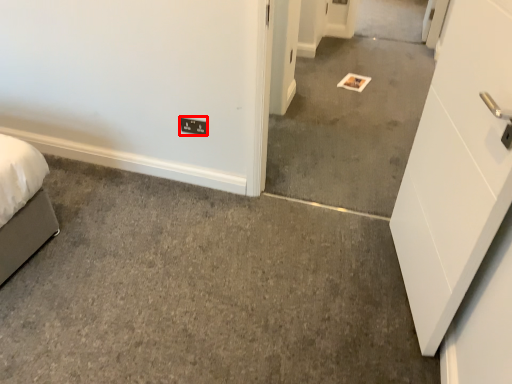
Question: In this image, where is light switch (annotated by the red box) located relative to concrete?

Choices:
 (A) left
 (B) right

Answer: (A)